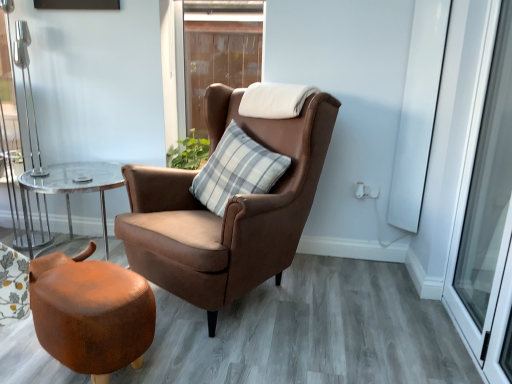
Question: Based on their sizes in the image, would you say gray striped cushion at center is bigger or smaller than green leafy plant at upper center?

Choices:
 (A) big
 (B) small

Answer: (A)

Question: From the image's perspective, relative to green leafy plant at upper center, is gray striped cushion at center above or below?

Choices:
 (A) below
 (B) above

Answer: (A)

Question: Which object is the farthest from the clear glass table at left?

Choices:
 (A) brown wooden window at upper center
 (B) gray striped cushion at center
 (C) matte brown stool at lower left
 (D) white glossy screen door at upper right, the second screen door in the front-to-back sequence
 (E) transparent glass screen door at right, marked as the 1th screen door in a front-to-back arrangement

Answer: (E)

Question: Based on their relative distances, which object is farther from the brown leather chair at center?

Choices:
 (A) transparent glass screen door at right, which is the 2th screen door from back to front
 (B) white glossy screen door at upper right, the second screen door in the front-to-back sequence
 (C) clear glass table at left
 (D) gray striped cushion at center
 (E) green leafy plant at upper center

Answer: (A)